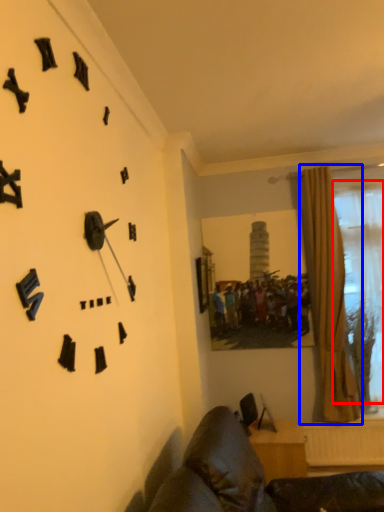
Question: Which object is closer to the camera taking this photo, bay window (highlighted by a red box) or curtain (highlighted by a blue box)?

Choices:
 (A) bay window
 (B) curtain

Answer: (B)